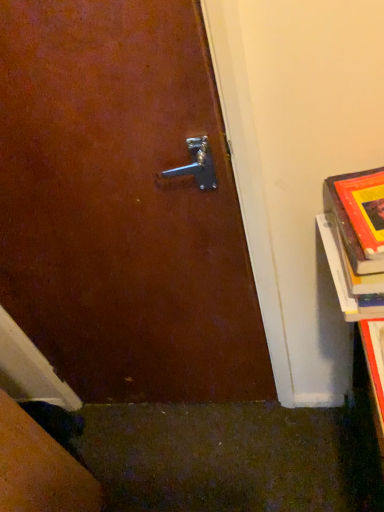
The image size is (384, 512). What do you see at coordinates (359, 237) in the screenshot?
I see `hardcover book at right` at bounding box center [359, 237].

Where is `hardcover book at right`? hardcover book at right is located at coordinates pyautogui.click(x=359, y=237).

The height and width of the screenshot is (512, 384). What do you see at coordinates (373, 364) in the screenshot?
I see `hardcover book at lower right` at bounding box center [373, 364].

You are a GUI agent. You are given a task and a screenshot of the screen. Output one action in this format:
    pyautogui.click(x=<x>, y=<y>)
    Task: Click on the hardcover book at lower right
    
    Given the screenshot: What is the action you would take?
    pyautogui.click(x=373, y=364)

Where is `hardcover book at right`? This screenshot has width=384, height=512. hardcover book at right is located at coordinates (359, 237).

Is hardcover book at lower right to the left or to the right of hardcover book at right in the image?

Based on their positions, hardcover book at lower right is located to the left of hardcover book at right.

Which object is closer to the camera taking this photo, hardcover book at lower right or hardcover book at right?

Positioned in front is hardcover book at lower right.

Does point (371, 377) come farther from viewer compared to point (369, 262)?

Yes, it is behind point (369, 262).

From the image's perspective, would you say hardcover book at lower right is shown under hardcover book at right?

Correct, hardcover book at lower right appears lower than hardcover book at right in the image.

From a real-world perspective, relative to hardcover book at right, is hardcover book at lower right vertically above or below?

hardcover book at lower right is situated lower than hardcover book at right in the real world.

Which of these two, hardcover book at lower right or hardcover book at right, is wider?

With larger width is hardcover book at right.

Between hardcover book at lower right and hardcover book at right, which one has less height?

Standing shorter between the two is hardcover book at lower right.

Does hardcover book at lower right have a larger size compared to hardcover book at right?

No.

Would you say hardcover book at lower right is outside hardcover book at right?

hardcover book at lower right is positioned outside hardcover book at right.

Does hardcover book at lower right touch hardcover book at right?

No.

Is hardcover book at lower right oriented towards hardcover book at right?

No, hardcover book at lower right is not turned towards hardcover book at right.

What's the angular difference between hardcover book at lower right and hardcover book at right's facing directions?

They differ by 2.83 degrees in their facing directions.

There is a hardcover book at lower right. Where is `book above it (from a real-world perspective)`? This screenshot has height=512, width=384. book above it (from a real-world perspective) is located at coordinates (359, 237).

Which object is positioned more to the left, hardcover book at right or hardcover book at lower right?

Positioned to the left is hardcover book at lower right.

Considering their positions, is hardcover book at right located in front of or behind hardcover book at lower right?

hardcover book at right is behind hardcover book at lower right.

Is point (372, 243) closer or farther from the camera than point (379, 375)?

Point (372, 243).

From the image's perspective, would you say hardcover book at right is shown under hardcover book at lower right?

No.

From a real-world perspective, which object rests below the other?

hardcover book at lower right, from a real-world perspective.

Looking at this image, which object is thinner, hardcover book at right or hardcover book at lower right?

With smaller width is hardcover book at lower right.

Who is shorter, hardcover book at right or hardcover book at lower right?

Standing shorter between the two is hardcover book at lower right.

Can you confirm if hardcover book at right is smaller than hardcover book at lower right?

No, hardcover book at right is not smaller than hardcover book at lower right.

Is hardcover book at right inside or outside of hardcover book at lower right?

hardcover book at right is not enclosed by hardcover book at lower right.

Is there a large distance between hardcover book at right and hardcover book at lower right?

No, hardcover book at right is not far away from hardcover book at lower right.

Could you tell me if hardcover book at right is facing hardcover book at lower right?

Yes, hardcover book at right is turned towards hardcover book at lower right.

Identify the location of book on the right of hardcover book at lower right. Image resolution: width=384 pixels, height=512 pixels. (359, 237).

This screenshot has height=512, width=384. Find the location of `book cover on the left of hardcover book at right`. book cover on the left of hardcover book at right is located at coordinates (373, 364).

I want to click on book cover located underneath the hardcover book at right (from a real-world perspective), so click(373, 364).